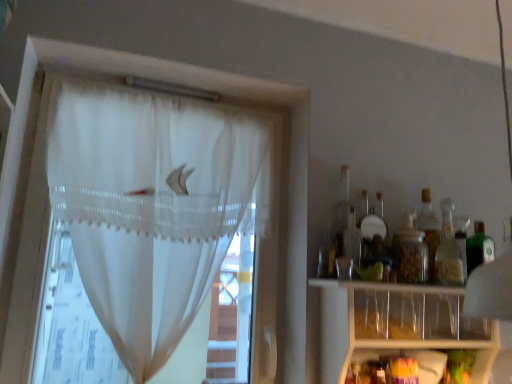
Question: Is clear plastic shelf at lower right facing towards white sheer curtain at left?

Choices:
 (A) no
 (B) yes

Answer: (A)

Question: Considering the relative sizes of clear plastic shelf at lower right and white sheer curtain at left in the image provided, is clear plastic shelf at lower right wider than white sheer curtain at left?

Choices:
 (A) no
 (B) yes

Answer: (B)

Question: Considering the relative sizes of clear plastic shelf at lower right and white sheer curtain at left in the image provided, is clear plastic shelf at lower right smaller than white sheer curtain at left?

Choices:
 (A) yes
 (B) no

Answer: (A)

Question: From a real-world perspective, is clear plastic shelf at lower right positioned under white sheer curtain at left based on gravity?

Choices:
 (A) yes
 (B) no

Answer: (A)

Question: Is clear plastic shelf at lower right closer to the viewer compared to white sheer curtain at left?

Choices:
 (A) no
 (B) yes

Answer: (B)

Question: Is clear plastic shelf at lower right taller than white sheer curtain at left?

Choices:
 (A) yes
 (B) no

Answer: (B)

Question: Does translucent glass bottle at right, acting as the second bottle starting from the left, appear on the right side of white sheer curtain at left?

Choices:
 (A) no
 (B) yes

Answer: (B)

Question: Is translucent glass bottle at right, positioned as the 1th bottle in right-to-left order, outside white sheer curtain at left?

Choices:
 (A) yes
 (B) no

Answer: (A)

Question: From a real-world perspective, is translucent glass bottle at right, acting as the second bottle starting from the left, physically below white sheer curtain at left?

Choices:
 (A) yes
 (B) no

Answer: (B)

Question: Can you confirm if translucent glass bottle at right, acting as the second bottle starting from the left, is taller than white sheer curtain at left?

Choices:
 (A) no
 (B) yes

Answer: (A)

Question: Is translucent glass bottle at right, positioned as the 1th bottle in right-to-left order, in front of white sheer curtain at left?

Choices:
 (A) yes
 (B) no

Answer: (B)

Question: Does translucent glass bottle at right, acting as the second bottle starting from the left, have a smaller size compared to white sheer curtain at left?

Choices:
 (A) no
 (B) yes

Answer: (B)

Question: Is transparent glass jar at right, the second bottle positioned from the right, at the right side of translucent glass bottle at right, acting as the second bottle starting from the left?

Choices:
 (A) yes
 (B) no

Answer: (B)